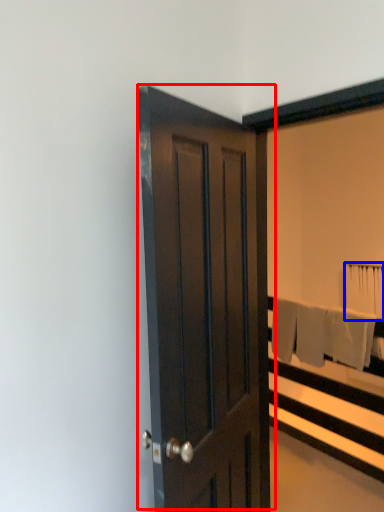
Question: Which of the following is the closest to the observer, door (highlighted by a red box) or bath towel (highlighted by a blue box)?

Choices:
 (A) door
 (B) bath towel

Answer: (A)